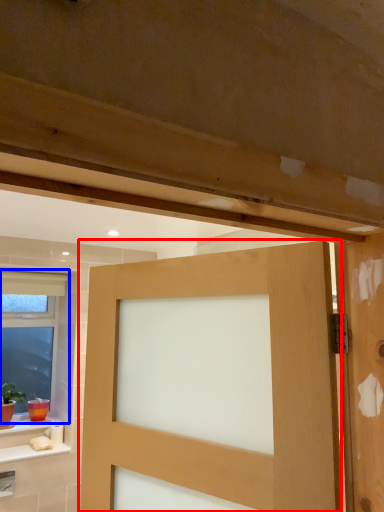
Question: Which of the following is the closest to the observer, door (highlighted by a red box) or window (highlighted by a blue box)?

Choices:
 (A) door
 (B) window

Answer: (A)